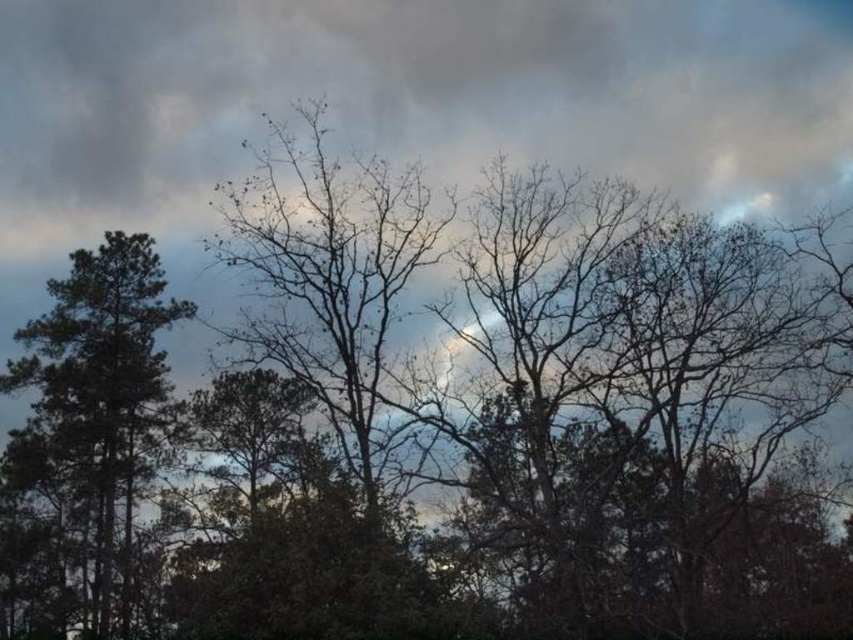
You are an artist trying to paint the scene. You want to ensure the bare branches at center and the green matte tree at left are proportionally accurate. Which object is wider in the image?

The bare branches at center are wider than the green matte tree at left.

You are an observer standing in the middle of the forest looking towards the trees. Which object, the bare branches at center or the green matte tree at left, is located higher in the scene?

The bare branches at center is positioned over the green matte tree at left, so it is higher in the scene.